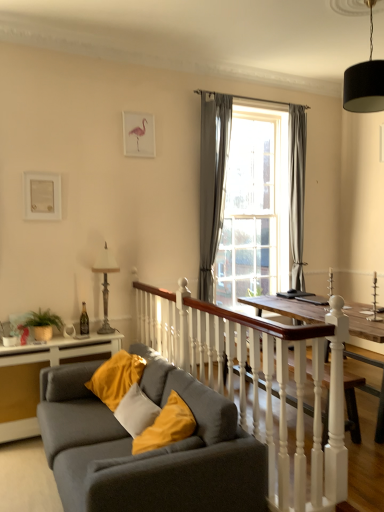
Question: From a real-world perspective, does metallic silver lamp at left sit lower than black fabric lampshade at upper right?

Choices:
 (A) yes
 (B) no

Answer: (A)

Question: Considering the relative sizes of metallic silver lamp at left and black fabric lampshade at upper right in the image provided, is metallic silver lamp at left thinner than black fabric lampshade at upper right?

Choices:
 (A) yes
 (B) no

Answer: (A)

Question: Does metallic silver lamp at left have a greater height compared to black fabric lampshade at upper right?

Choices:
 (A) yes
 (B) no

Answer: (A)

Question: Is metallic silver lamp at left to the left of black fabric lampshade at upper right from the viewer's perspective?

Choices:
 (A) no
 (B) yes

Answer: (B)

Question: From a real-world perspective, is metallic silver lamp at left physically above black fabric lampshade at upper right?

Choices:
 (A) yes
 (B) no

Answer: (B)

Question: Is metallic silver lamp at left behind black fabric lampshade at upper right?

Choices:
 (A) yes
 (B) no

Answer: (A)

Question: Is gray fabric curtain at center, arranged as the second curtain when viewed from the right, touching white matte picture frame at upper left, the 1th picture frame from the bottom?

Choices:
 (A) no
 (B) yes

Answer: (A)

Question: Can you confirm if gray fabric curtain at center, arranged as the 1th curtain when viewed from the left, is shorter than white matte picture frame at upper left, which is the 2th picture frame from back to front?

Choices:
 (A) no
 (B) yes

Answer: (A)

Question: Does gray fabric curtain at center, arranged as the second curtain when viewed from the right, appear on the left side of white matte picture frame at upper left, which is the 2th picture frame in right-to-left order?

Choices:
 (A) no
 (B) yes

Answer: (A)

Question: Is gray fabric curtain at center, the second curtain from the back, smaller than white matte picture frame at upper left, acting as the 1th picture frame starting from the front?

Choices:
 (A) no
 (B) yes

Answer: (A)

Question: Can we say gray fabric curtain at center, arranged as the second curtain when viewed from the right, lies outside white matte picture frame at upper left, which is the 2th picture frame from back to front?

Choices:
 (A) no
 (B) yes

Answer: (B)

Question: Does gray fabric curtain at center, the second curtain from the back, have a greater width compared to white matte picture frame at upper left, which is counted as the second picture frame, starting from the top?

Choices:
 (A) no
 (B) yes

Answer: (B)

Question: Does gray fabric curtain at center, the 1th curtain positioned from the front, have a lesser width compared to black fabric lampshade at upper right?

Choices:
 (A) no
 (B) yes

Answer: (B)